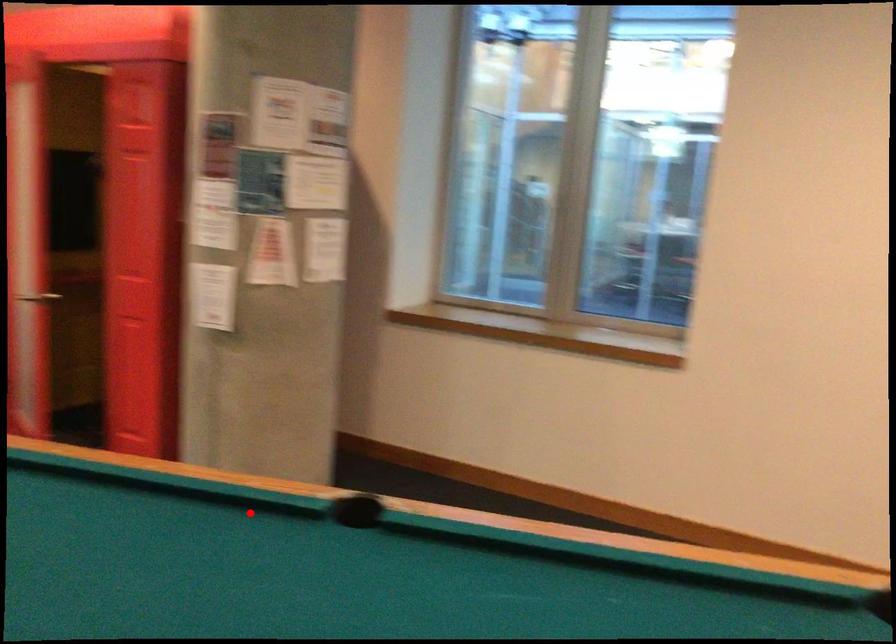
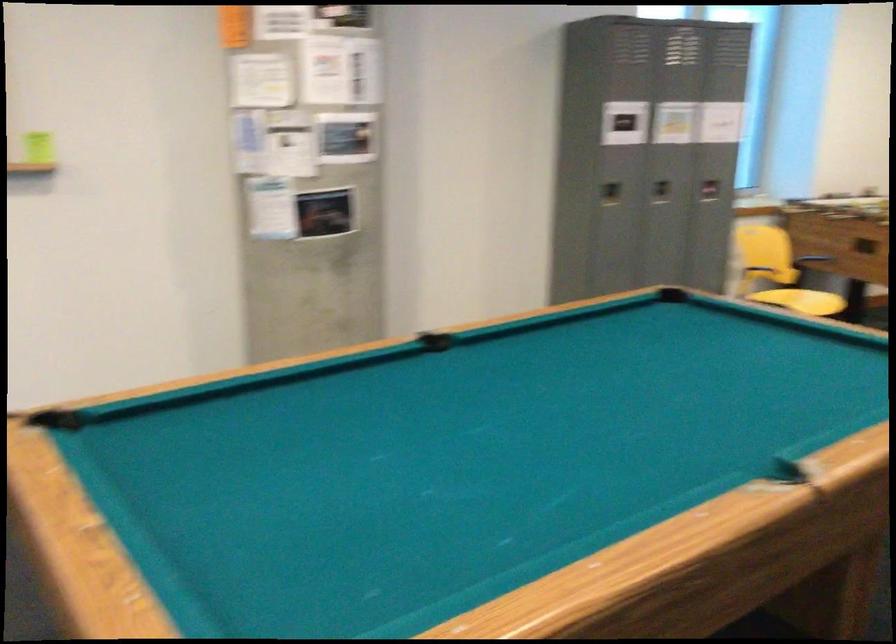
Where in the second image is the point corresponding to the highlighted location from the first image?

(788, 473)